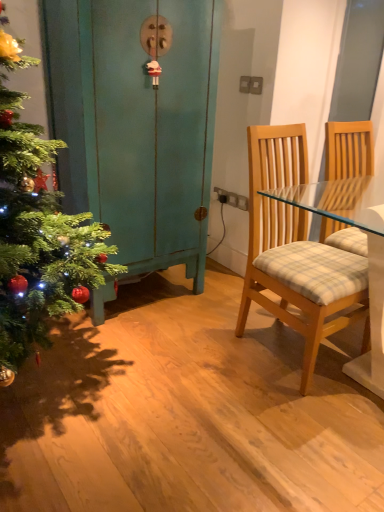
The image size is (384, 512). In order to click on vacant area to the right of teal painted wood dresser at left in this screenshot , I will do `click(210, 308)`.